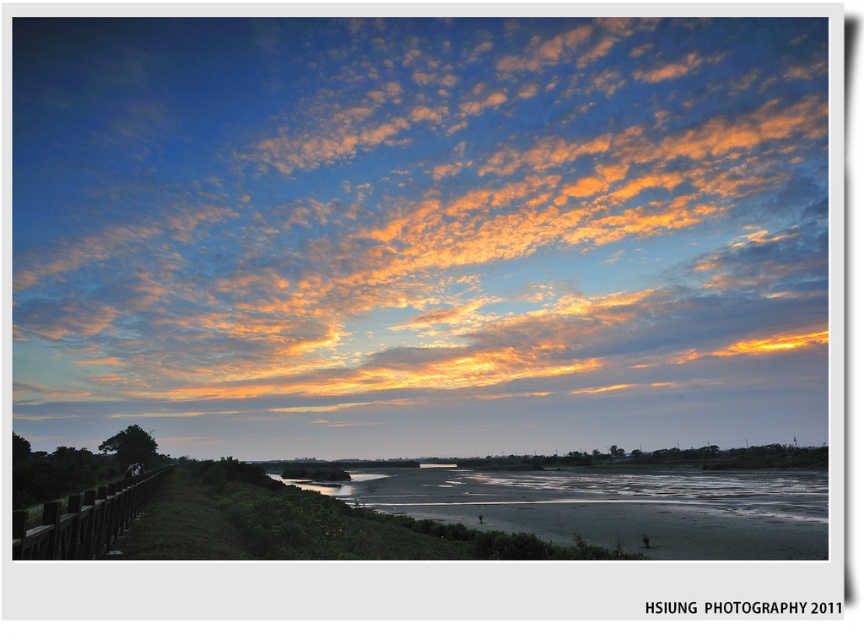
Question: Which object is farther from the camera taking this photo?

Choices:
 (A) cloudy sky at upper center
 (B) brown wooden fence at lower left
 (C) sandy brown river at lower center

Answer: (A)

Question: Which object appears farthest from the camera in this image?

Choices:
 (A) sandy brown river at lower center
 (B) brown wooden fence at lower left

Answer: (A)

Question: Which of the following is the closest to the observer?

Choices:
 (A) (674, 544)
 (B) (685, 330)

Answer: (A)

Question: Can you confirm if sandy brown river at lower center is thinner than brown wooden fence at lower left?

Choices:
 (A) yes
 (B) no

Answer: (B)

Question: Is cloudy sky at upper center closer to the viewer compared to brown wooden fence at lower left?

Choices:
 (A) no
 (B) yes

Answer: (A)

Question: Does cloudy sky at upper center appear on the right side of sandy brown river at lower center?

Choices:
 (A) yes
 (B) no

Answer: (B)